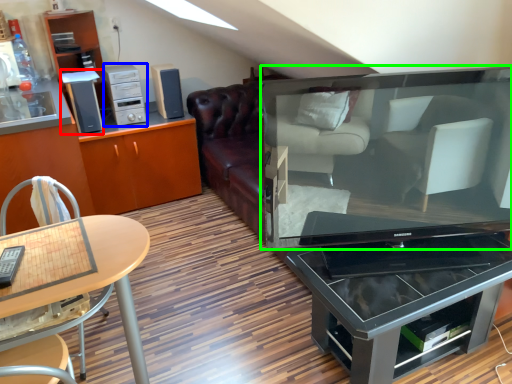
Question: Which object is the closest to the appliance (highlighted by a red box)? Choose among these: appliance (highlighted by a blue box) or television (highlighted by a green box).

Choices:
 (A) appliance
 (B) television

Answer: (A)